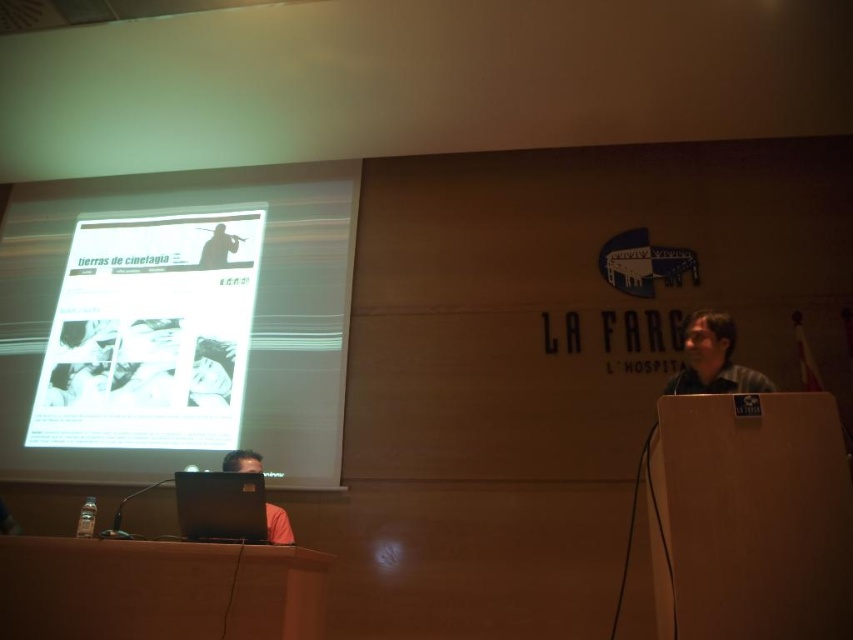
Question: Among these points, which one is nearest to the camera?

Choices:
 (A) coord(672,378)
 (B) coord(196,531)
 (C) coord(202,228)

Answer: (B)

Question: Does white matte projection screen at upper left have a lesser width compared to matte black laptop at lower left?

Choices:
 (A) yes
 (B) no

Answer: (B)

Question: Can you confirm if black matte laptop at lower center is positioned above matte black laptop at upper left?

Choices:
 (A) no
 (B) yes

Answer: (A)

Question: Considering the relative positions of matte gray shirt at right and matte black laptop at lower left in the image provided, where is matte gray shirt at right located with respect to matte black laptop at lower left?

Choices:
 (A) left
 (B) right

Answer: (B)

Question: Which point is closer to the camera?

Choices:
 (A) matte black laptop at upper left
 (B) white matte projection screen at upper left
 (C) matte black laptop at lower left
 (D) black matte laptop at lower center

Answer: (D)

Question: Based on their relative distances, which object is nearer to the matte gray shirt at right?

Choices:
 (A) matte black laptop at lower left
 (B) white matte projection screen at upper left
 (C) black matte laptop at lower center
 (D) matte black laptop at upper left

Answer: (C)